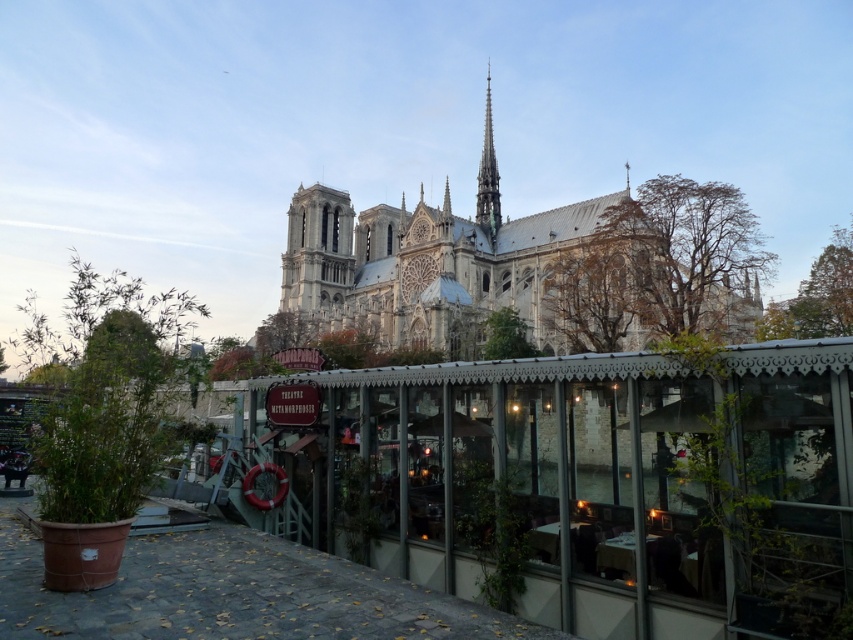
In the scene shown: Does white stone church at center have a greater width compared to green copper spire at upper center?

Yes.

Does white stone church at center have a smaller size compared to green copper spire at upper center?

No, white stone church at center is not smaller than green copper spire at upper center.

The height and width of the screenshot is (640, 853). Find the location of `white stone church at center`. white stone church at center is located at coordinates (527, 269).

The image size is (853, 640). What are the coordinates of `white stone church at center` in the screenshot? It's located at (527, 269).